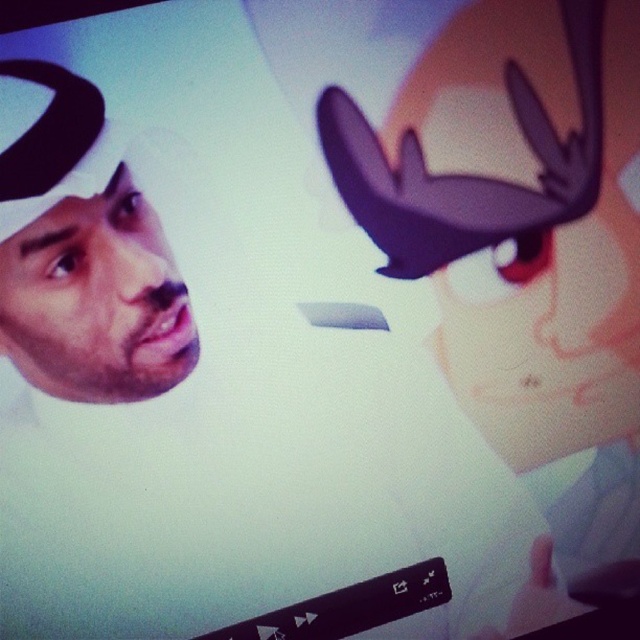
Question: Is matte purple hat at upper right behind matte white headscarf at left?

Choices:
 (A) no
 (B) yes

Answer: (B)

Question: Is the position of matte purple hat at upper right more distant than that of matte white headscarf at left?

Choices:
 (A) no
 (B) yes

Answer: (B)

Question: Considering the relative positions of matte purple hat at upper right and matte white headscarf at left in the image provided, where is matte purple hat at upper right located with respect to matte white headscarf at left?

Choices:
 (A) below
 (B) above

Answer: (A)

Question: Among these points, which one is farthest from the camera?

Choices:
 (A) (456, 380)
 (B) (40, 241)

Answer: (A)